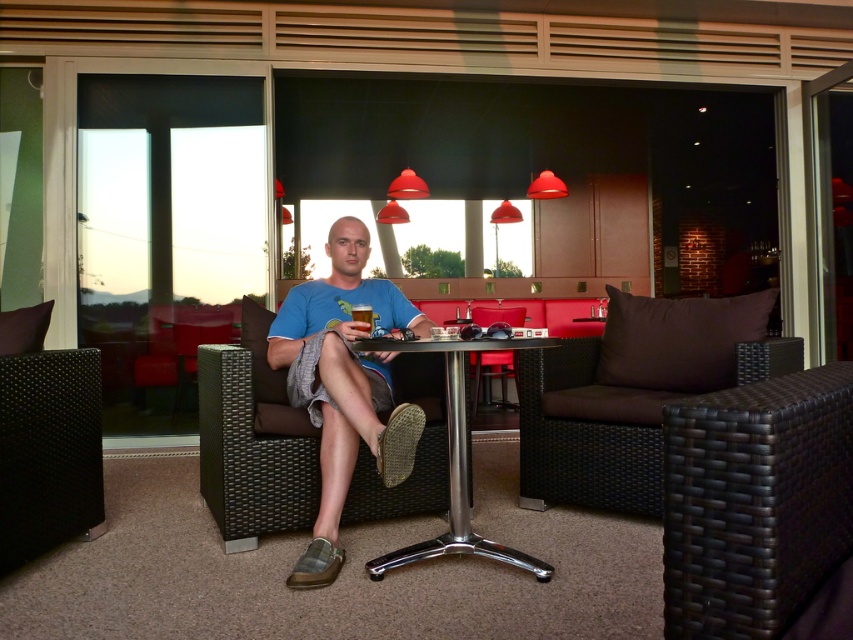
Can you confirm if polished metal table at center is thinner than translucent glass beer at center?

No, polished metal table at center is not thinner than translucent glass beer at center.

Is polished metal table at center below translucent glass beer at center?

Yes.

What do you see at coordinates (457, 464) in the screenshot? I see `polished metal table at center` at bounding box center [457, 464].

Locate an element on the screen. This screenshot has height=640, width=853. polished metal table at center is located at coordinates (457, 464).

Between point (569, 374) and point (306, 557), which one is positioned behind?

The point (569, 374) is more distant.

Which is behind, point (734, 380) or point (305, 372)?

Point (734, 380)

Locate an element on the screen. The height and width of the screenshot is (640, 853). brown woven couch at center is located at coordinates (633, 394).

Who is lower down, transparent glass door at upper left or brown woven chair at right?

brown woven chair at right is below.

Between transparent glass door at upper left and brown woven chair at right, which one is positioned higher?

Positioned higher is transparent glass door at upper left.

Which is in front, point (213, 298) or point (775, 577)?

Point (775, 577) is in front.

The image size is (853, 640). I want to click on transparent glass door at upper left, so click(x=166, y=232).